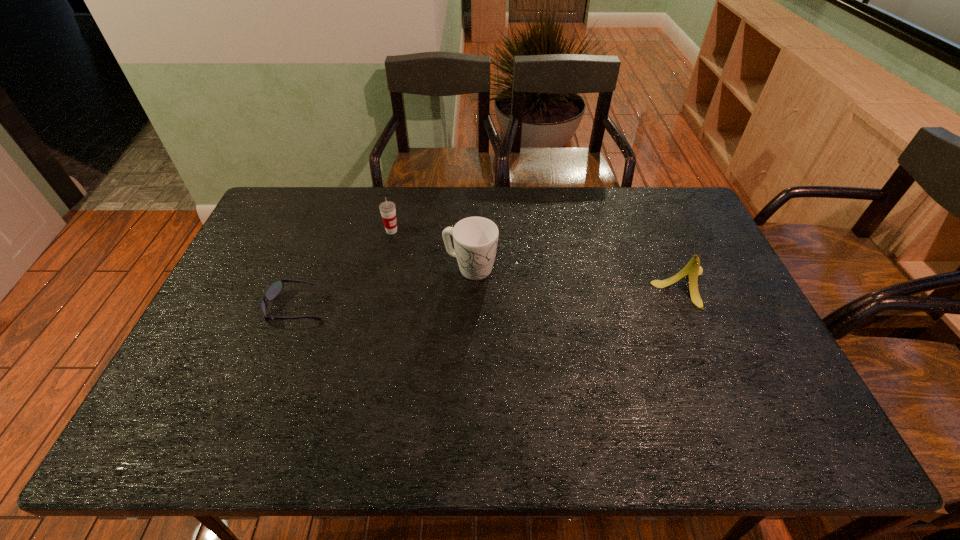
Identify the location of free space located 0.090m on the side of the mug with the handle. The height and width of the screenshot is (540, 960). (521, 288).

You are a GUI agent. You are given a task and a screenshot of the screen. Output one action in this format:
    pyautogui.click(x=<x>, y=<y>)
    Task: Click on the free region located on the side of the mug with the handle
    This screenshot has width=960, height=540.
    Given the screenshot: What is the action you would take?
    coord(518,287)

Identify the location of blank space located 0.120m on the side of the mug with the handle. The height and width of the screenshot is (540, 960). (530, 292).

This screenshot has width=960, height=540. Identify the location of object present at the far edge. (387, 209).

At what (x,y) coordinates should I click in order to perform the action: click on object situated at the left edge. Please return your answer as a coordinate pair (x, y). The height and width of the screenshot is (540, 960). Looking at the image, I should click on (274, 289).

This screenshot has width=960, height=540. In order to click on object located at the right edge in this screenshot , I will do coord(693,269).

Identify the location of vacant space at the far edge of the desktop. (454, 205).

I want to click on free location at the near edge, so click(x=645, y=404).

In the image, there is a desktop. At what (x,y) coordinates should I click in order to perform the action: click on vacant region at the right edge. Please return your answer as a coordinate pair (x, y). Looking at the image, I should click on [724, 299].

The height and width of the screenshot is (540, 960). In the image, there is a desktop. Identify the location of free space at the far right corner. (667, 188).